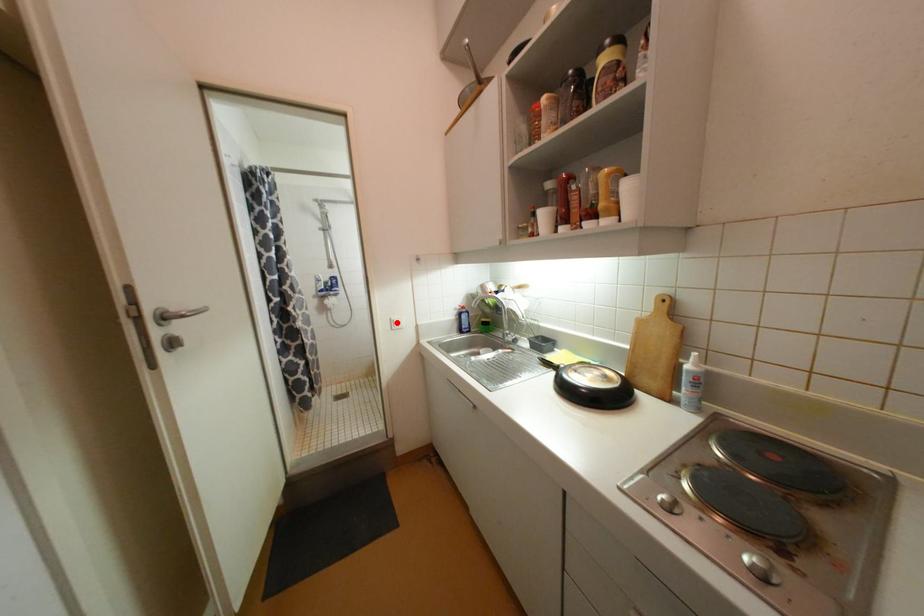
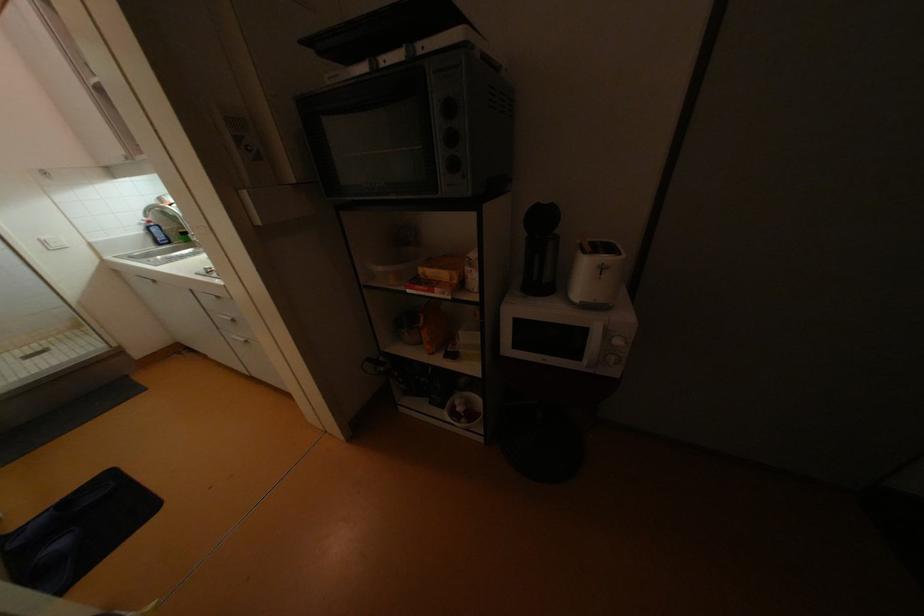
Question: I am providing you with two images of the same scene from different viewpoints. A red point is shown in image1. For the corresponding object point in image2, is it positioned nearer or farther from the camera?

Choices:
 (A) Nearer
 (B) Farther

Answer: (B)